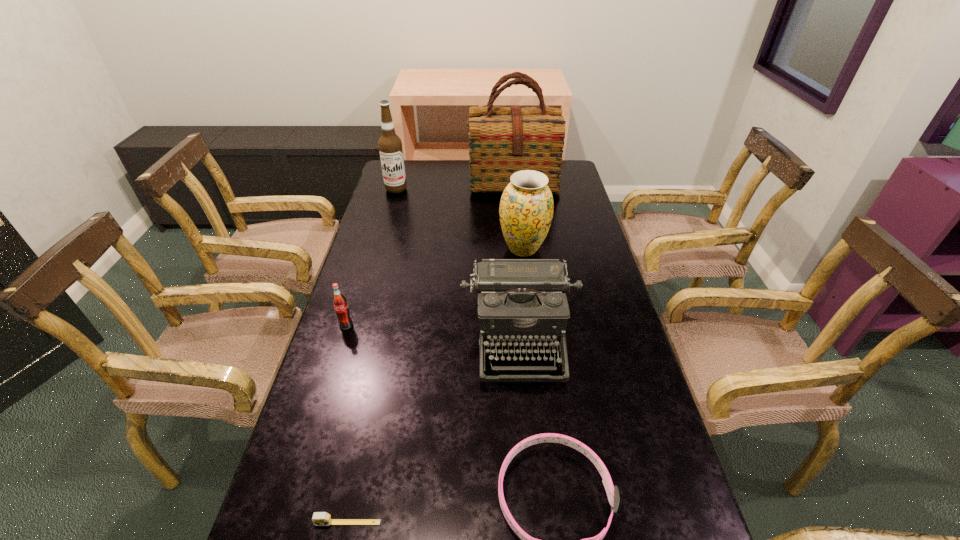
Locate which object ranks in proximity to the sixth tallest object. Please provide its 2D coordinates. Your answer should be formatted as a tuple, i.e. [(x, y)], where the tuple contains the x and y coordinates of a point satisfying the conditions above.

[(521, 302)]

Identify the location of object that is the fifth closest one to the dog collar. The height and width of the screenshot is (540, 960). (502, 140).